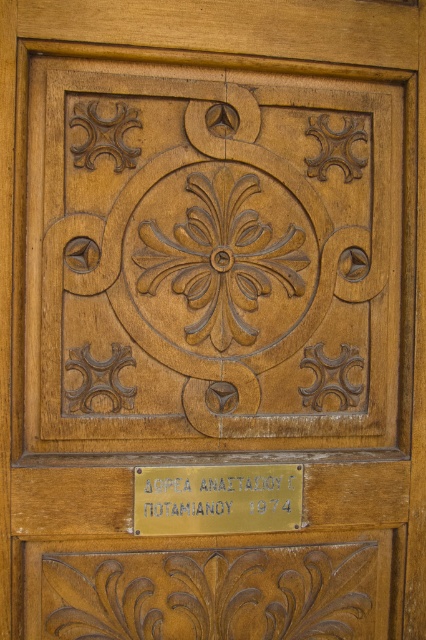
Does wooden carved design at center have a greater width compared to brown carved flower at center?

Indeed, wooden carved design at center has a greater width compared to brown carved flower at center.

Can you confirm if wooden carved design at center is positioned to the right of brown carved flower at center?

Indeed, wooden carved design at center is positioned on the right side of brown carved flower at center.

Does point (301, 132) come closer to viewer compared to point (199, 269)?

No.

Where is `wooden carved design at center`? wooden carved design at center is located at coordinates (247, 268).

Who is higher up, wooden carved design at center or gold metallic plaque at center?

wooden carved design at center is above.

Where is `wooden carved design at center`? The image size is (426, 640). wooden carved design at center is located at coordinates (247, 268).

In order to click on wooden carved design at center in this screenshot , I will do `click(247, 268)`.

Is brown carved flower at center above gold metallic plaque at center?

Yes, brown carved flower at center is above gold metallic plaque at center.

Which is in front, point (302, 291) or point (141, 525)?

Point (141, 525)

Is point (189, 332) positioned behind point (227, 518)?

That is False.

The height and width of the screenshot is (640, 426). I want to click on brown carved flower at center, so click(x=221, y=259).